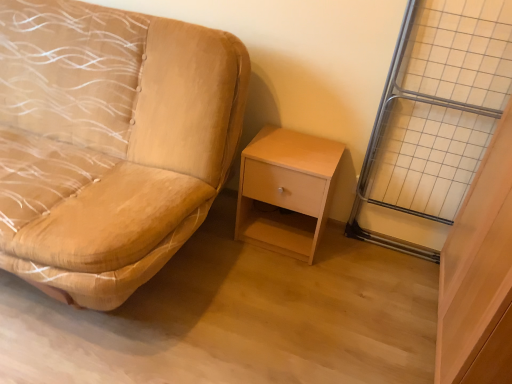
Question: Does metal grid at right appear on the left side of suede-like beige studio couch at left?

Choices:
 (A) no
 (B) yes

Answer: (A)

Question: Does metal grid at right touch suede-like beige studio couch at left?

Choices:
 (A) no
 (B) yes

Answer: (A)

Question: Is metal grid at right in front of suede-like beige studio couch at left?

Choices:
 (A) no
 (B) yes

Answer: (A)

Question: From the image's perspective, is metal grid at right above suede-like beige studio couch at left?

Choices:
 (A) yes
 (B) no

Answer: (B)

Question: From a real-world perspective, is metal grid at right positioned under suede-like beige studio couch at left based on gravity?

Choices:
 (A) yes
 (B) no

Answer: (B)

Question: Considering the relative sizes of metal grid at right and suede-like beige studio couch at left in the image provided, is metal grid at right shorter than suede-like beige studio couch at left?

Choices:
 (A) yes
 (B) no

Answer: (B)

Question: Is light wood/finely finished nightstand at center-right outside of metal grid at right?

Choices:
 (A) no
 (B) yes

Answer: (B)

Question: Are light wood/finely finished nightstand at center-right and metal grid at right located far from each other?

Choices:
 (A) no
 (B) yes

Answer: (A)

Question: Can you confirm if light wood/finely finished nightstand at center-right is wider than metal grid at right?

Choices:
 (A) no
 (B) yes

Answer: (B)

Question: From the image's perspective, would you say light wood/finely finished nightstand at center-right is shown under metal grid at right?

Choices:
 (A) yes
 (B) no

Answer: (A)

Question: Is light wood/finely finished nightstand at center-right directly adjacent to metal grid at right?

Choices:
 (A) no
 (B) yes

Answer: (A)

Question: From a real-world perspective, is light wood/finely finished nightstand at center-right below metal grid at right?

Choices:
 (A) no
 (B) yes

Answer: (B)

Question: Does metal grid at right turn towards light wood/finely finished nightstand at center-right?

Choices:
 (A) yes
 (B) no

Answer: (B)